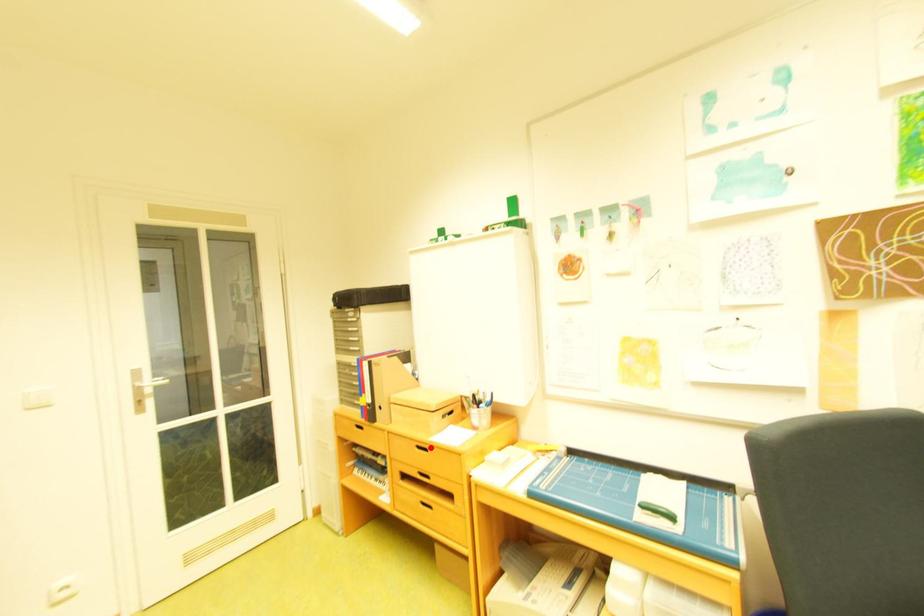
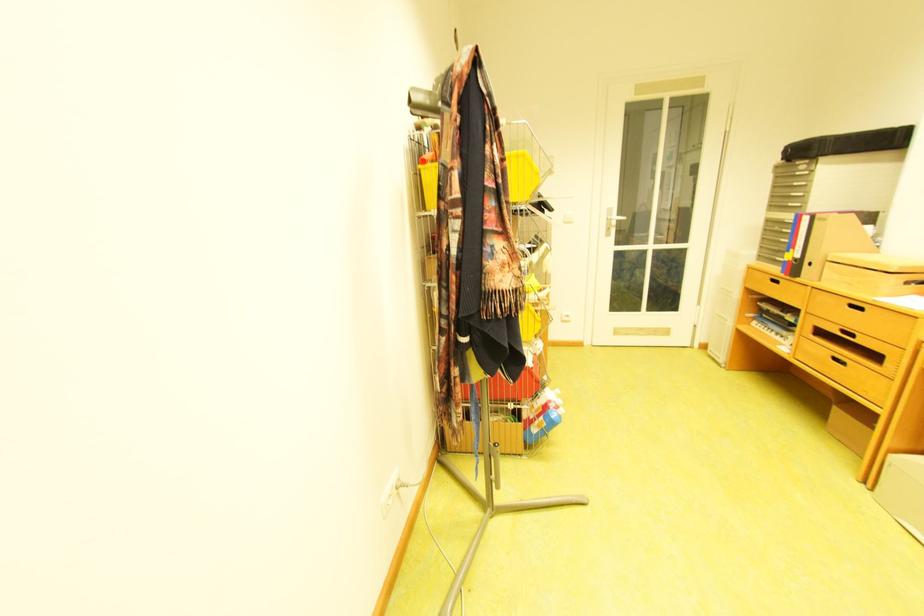
Locate, in the second image, the point that corresponds to the highlighted location in the first image.

(862, 307)